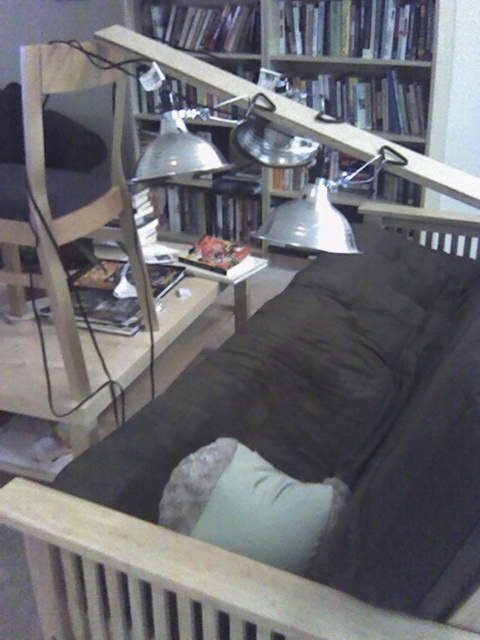
Question: In this image, where is metallic/reflective bookcase at upper center located relative to wooden chair at left?

Choices:
 (A) left
 (B) right

Answer: (B)

Question: In this image, where is wooden chair at left located relative to light gray fabric pillow at lower center?

Choices:
 (A) above
 (B) below

Answer: (A)

Question: Which of these objects is positioned farthest from the dark fabric couch at center?

Choices:
 (A) metallic/reflective bookcase at upper center
 (B) wooden chair at left
 (C) light gray fabric pillow at lower center

Answer: (A)

Question: Where is dark fabric couch at center located in relation to wooden chair at left in the image?

Choices:
 (A) below
 (B) above

Answer: (A)

Question: Which point is farther to the camera?

Choices:
 (A) wooden chair at left
 (B) metallic/reflective bookcase at upper center

Answer: (B)

Question: Which of the following is the closest to the observer?

Choices:
 (A) (310, 604)
 (B) (325, 513)
 (C) (70, 172)
 (D) (331, 557)

Answer: (A)